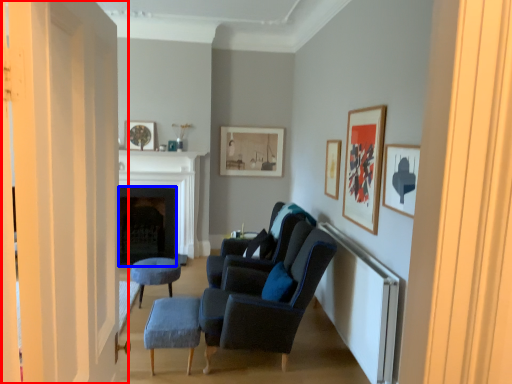
Question: Among these objects, which one is nearest to the camera, door (highlighted by a red box) or fireplace (highlighted by a blue box)?

Choices:
 (A) door
 (B) fireplace

Answer: (A)